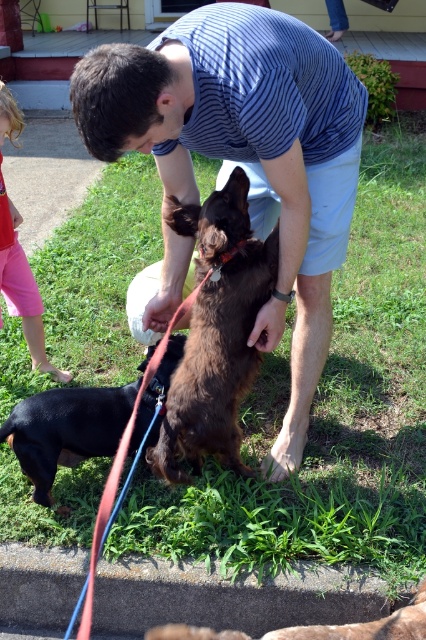
You are a photographer trying to capture a photo of the brown furry dog at lower center and the pink cotton shorts at lower left. Based on their heights, which one should you focus on first if you want to ensure both are in the frame without needing to adjust the camera angle?

The brown furry dog at lower center is shorter than the pink cotton shorts at lower left, so you should focus on the brown furry dog at lower center first to ensure both are in the frame without needing to adjust the camera angle.

You are a photographer trying to capture a photo of the brown furry dog at center and the pink cotton shorts at lower left. Based on their positions, which object is closer to the ground?

The brown furry dog at center is located below pink cotton shorts at lower left, so the brown furry dog at center is closer to the ground.

You are a photographer standing at the camera position. You want to take a closeup photo of the brown furry dog at center. The camera has a minimum focusing distance of 2 meters. Can you take the photo without moving closer?

Yes, the brown furry dog at center is 2.36 meters away from camera, which is within the minimum focusing distance of 2 meters. Therefore, you can take the photo without moving closer.